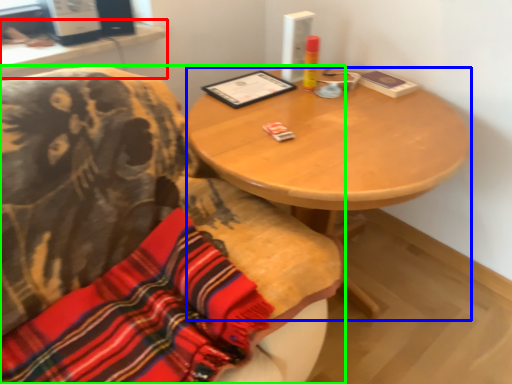
Question: Based on their relative distances, which object is nearer to computer desk (highlighted by a red box)? Choose from desk (highlighted by a blue box) and chair (highlighted by a green box).

Choices:
 (A) desk
 (B) chair

Answer: (B)